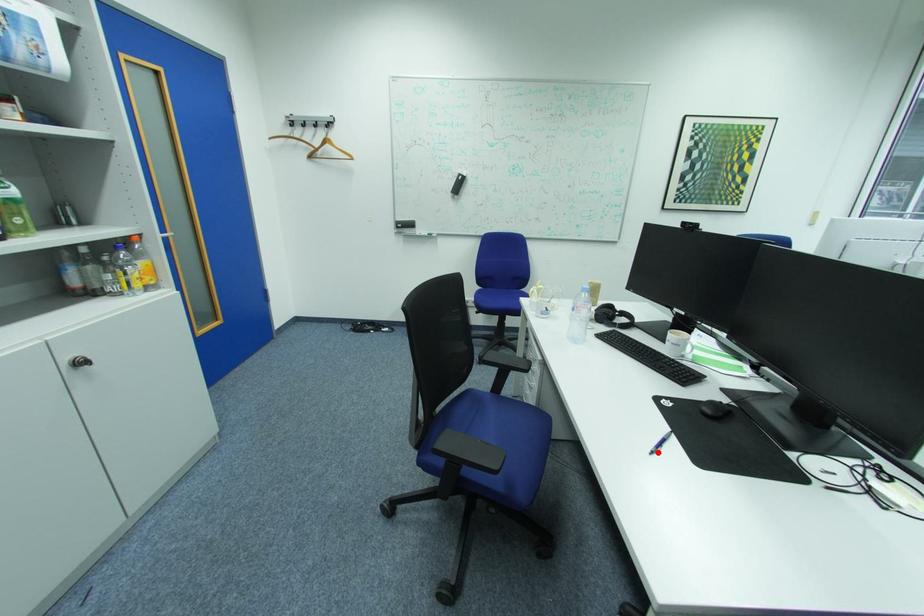
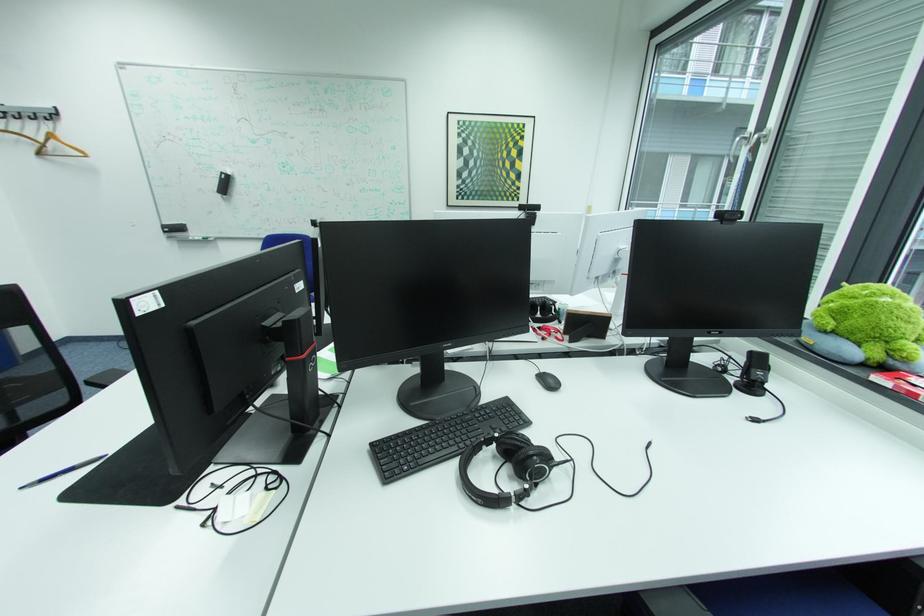
The point at the highlighted location is marked in the first image. Where is the corresponding point in the second image?

(32, 485)